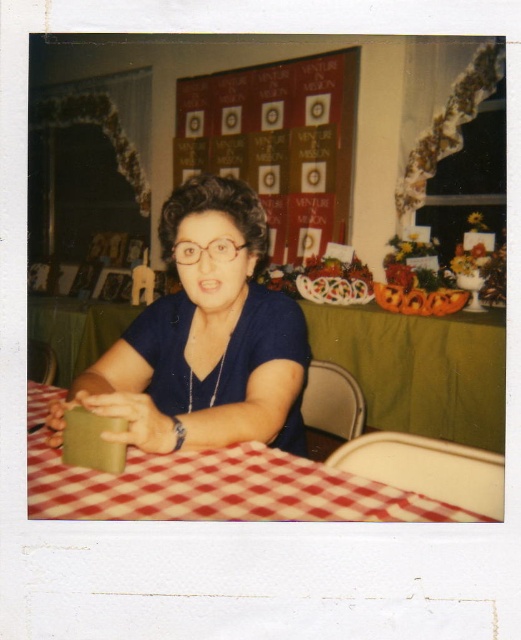
Who is more forward, (229, 211) or (225, 240)?

Point (225, 240) is in front.

Which is in front, point (158, 445) or point (238, 244)?

Point (158, 445)

Locate an element on the screen. blue fabric shirt at center is located at coordinates (204, 340).

Who is shorter, green fabric table at center or clear plastic glasses at center?

Standing shorter between the two is clear plastic glasses at center.

Which is above, green fabric table at center or clear plastic glasses at center?

clear plastic glasses at center is above.

Where is `green fabric table at center`? green fabric table at center is located at coordinates (420, 369).

Image resolution: width=521 pixels, height=640 pixels. In order to click on green fabric table at center in this screenshot , I will do `click(420, 369)`.

Can you confirm if blue fabric shirt at center is wider than maroon fabric bulletin board at upper center?

Incorrect, blue fabric shirt at center's width does not surpass maroon fabric bulletin board at upper center's.

Is the position of blue fabric shirt at center less distant than that of maroon fabric bulletin board at upper center?

Yes, it is.

Locate an element on the screen. This screenshot has height=640, width=521. blue fabric shirt at center is located at coordinates (204, 340).